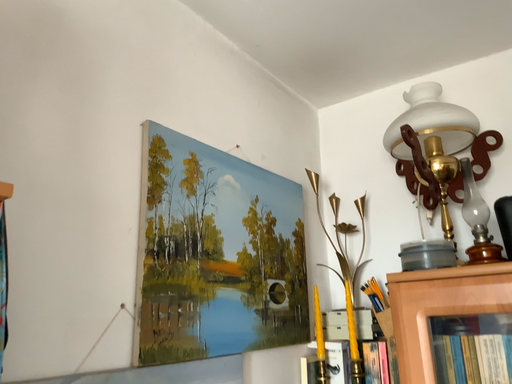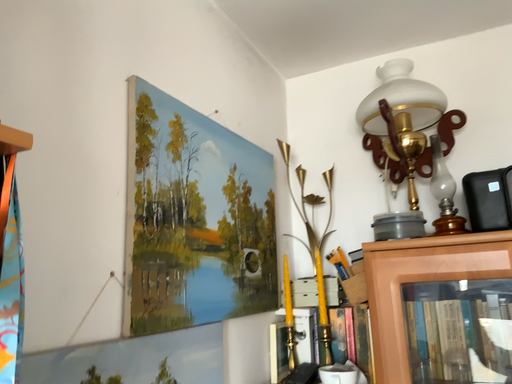
Question: How did the camera likely rotate when shooting the video?

Choices:
 (A) rotated left
 (B) rotated right

Answer: (B)